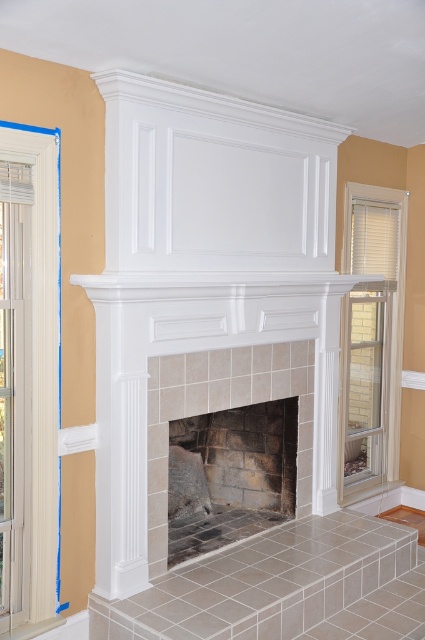
Question: Is clear glass door at right to the left of white glossy mantle at center from the viewer's perspective?

Choices:
 (A) yes
 (B) no

Answer: (B)

Question: Can you confirm if clear glass door at left is positioned to the left of white glossy mantle at center?

Choices:
 (A) no
 (B) yes

Answer: (B)

Question: Which point appears closest to the camera in this image?

Choices:
 (A) (45, 605)
 (B) (98, 292)
 (C) (252, 492)

Answer: (A)

Question: Which of the following is the farthest from the observer?

Choices:
 (A) white wood window at right
 (B) white glossy mantle at center

Answer: (A)

Question: Is white wood window at right smaller than clear glass door at right?

Choices:
 (A) yes
 (B) no

Answer: (B)

Question: Which object appears closest to the camera in this image?

Choices:
 (A) white glossy mantle at center
 (B) clear glass door at right
 (C) dark gray stone fireplace at center

Answer: (A)